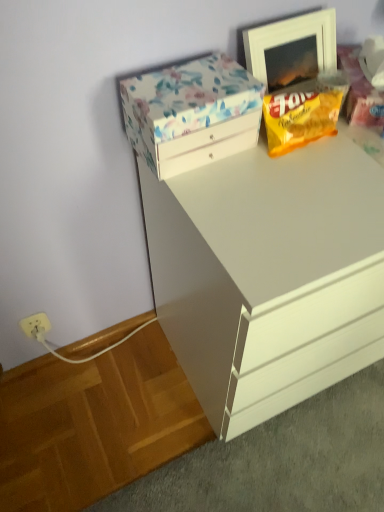
Find the location of a particular element. The image size is (384, 512). empty space that is ontop of floral-patterned cardboard box at upper left is located at coordinates (196, 82).